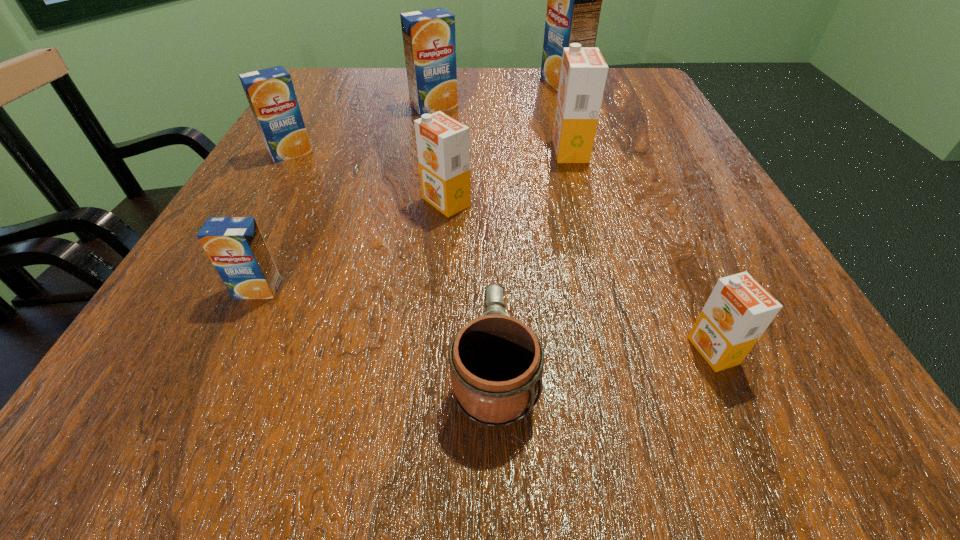
Identify the location of the biggest blue orange_juice. click(574, 0).

I want to click on the farthest blue orange_juice, so click(x=574, y=0).

Locate an element on the screen. the third nearest blue orange_juice is located at coordinates (429, 39).

Where is `the sixth nearest orange juice`? The image size is (960, 540). the sixth nearest orange juice is located at coordinates (429, 39).

The image size is (960, 540). Identify the location of the farthest orange orange juice. (583, 74).

The width and height of the screenshot is (960, 540). I want to click on the biggest orange orange juice, so click(x=583, y=74).

The width and height of the screenshot is (960, 540). I want to click on the third biggest blue orange_juice, so click(x=270, y=92).

The image size is (960, 540). Find the location of `the leftmost orange orange juice`. the leftmost orange orange juice is located at coordinates (443, 144).

Find the location of a particular element. the second farthest orange orange juice is located at coordinates (443, 144).

Image resolution: width=960 pixels, height=540 pixels. Identify the location of the sixth farthest object. (235, 245).